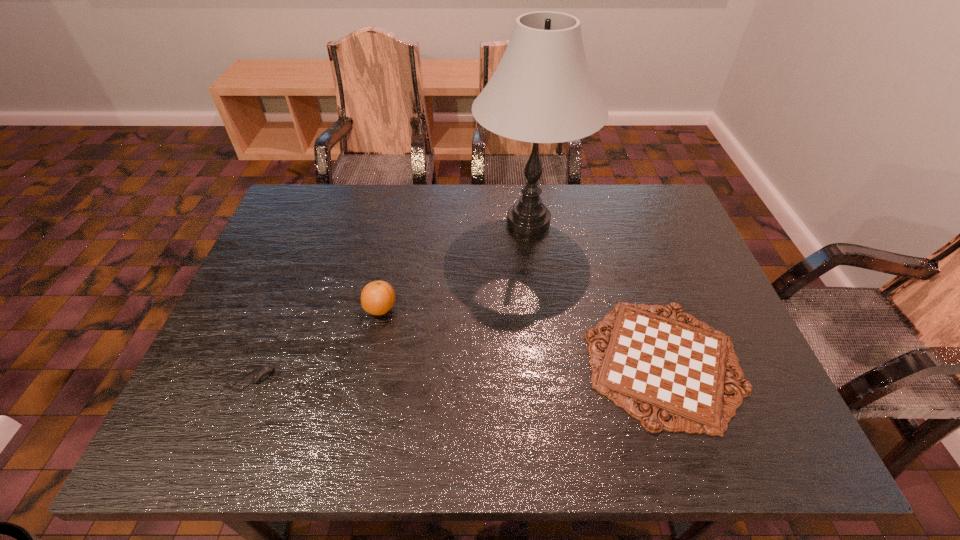
You are a GUI agent. You are given a task and a screenshot of the screen. Output one action in this format:
    pyautogui.click(x=<x>, y=<y>)
    Task: Click on the free space that satisfies the following two spatial constraints: 1. on the front side of the orange; 2. on the left side of the chessboard
    Image resolution: width=960 pixels, height=540 pixels.
    Given the screenshot: What is the action you would take?
    (371, 362)

Image resolution: width=960 pixels, height=540 pixels. Identify the location of blank space that satisfies the following two spatial constraints: 1. on the front side of the chessboard; 2. on the right side of the third shortest object. (371, 362).

Where is `free space that satisfies the following two spatial constraints: 1. on the back side of the farthest object; 2. on the left side of the third object from right to left`? The height and width of the screenshot is (540, 960). free space that satisfies the following two spatial constraints: 1. on the back side of the farthest object; 2. on the left side of the third object from right to left is located at coordinates (398, 221).

Find the location of `free region that satisfies the following two spatial constraints: 1. on the back side of the farthest object; 2. on the right side of the leftmost object`. free region that satisfies the following two spatial constraints: 1. on the back side of the farthest object; 2. on the right side of the leftmost object is located at coordinates (317, 221).